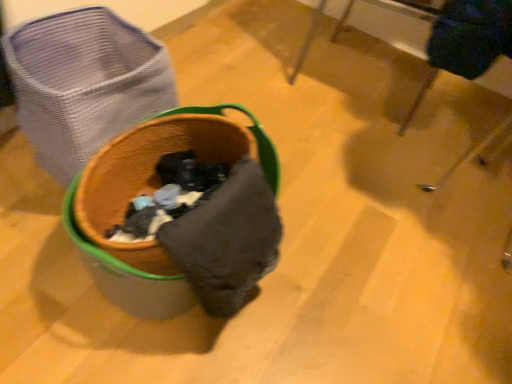
Image resolution: width=512 pixels, height=384 pixels. I want to click on free space that is to the left of wooden table at upper center, so click(x=252, y=52).